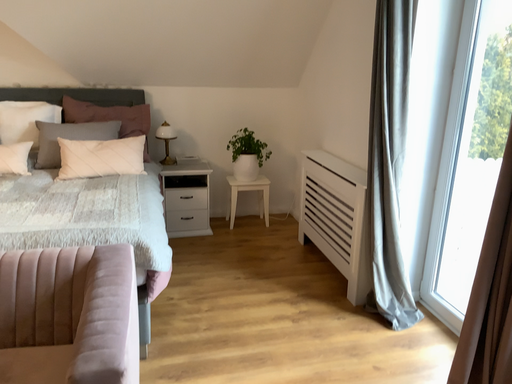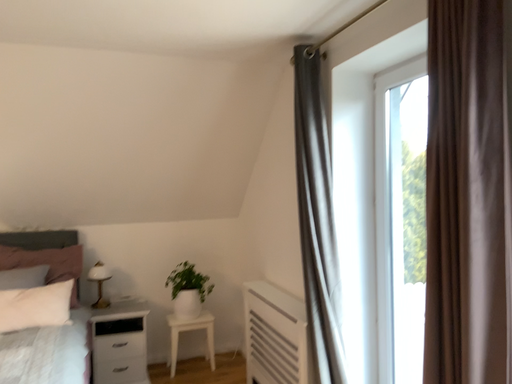
Question: Which way did the camera rotate in the video?

Choices:
 (A) rotated upward
 (B) rotated downward

Answer: (A)